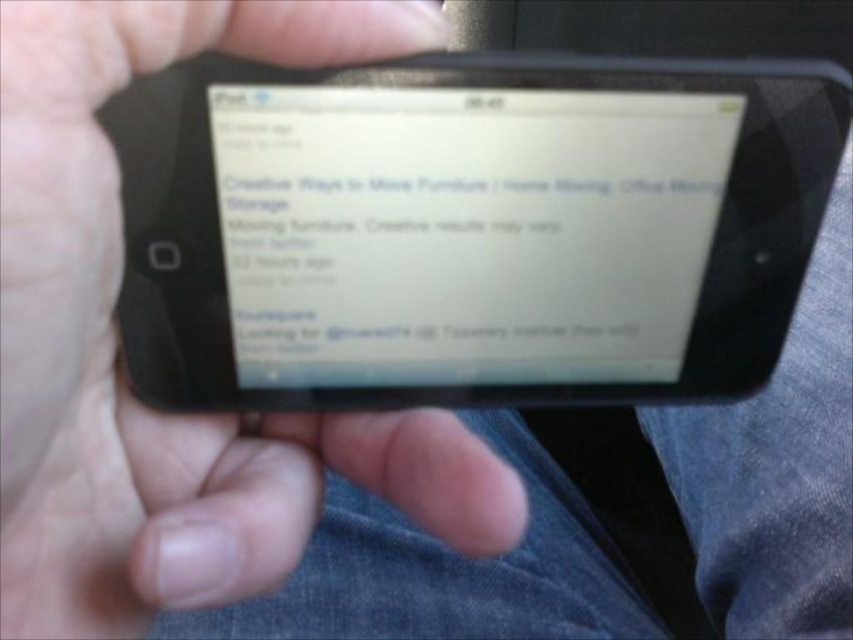
You are trying to take a photo of the text on the white matte screen at center using your black matte phone at center. However, you notice that the screen is reflecting too much light. What might be causing this reflection?

The black matte phone at center is in front of the white matte screen at center, so the screen is facing towards the phone, causing the reflection.

You are trying to determine if the black matte phone at center can fit into a phone case that is designed to fit the white matte screen at center. Based on their widths, will the case fit the phone?

The black matte phone at center has a lesser width compared to the white matte screen at center. Since the case is designed for the wider screen, it may not fit the narrower phone properly. You might need a case specifically sized for the black matte phone at center.

You are trying to take a photo of the text on the white matte screen at center using your black matte phone at center. However, the screen is reflecting too much light. Which object should you adjust to reduce the glare?

You should adjust the angle of the black matte phone at center since it is taller than the white matte screen at center, allowing you to position it to reduce glare.